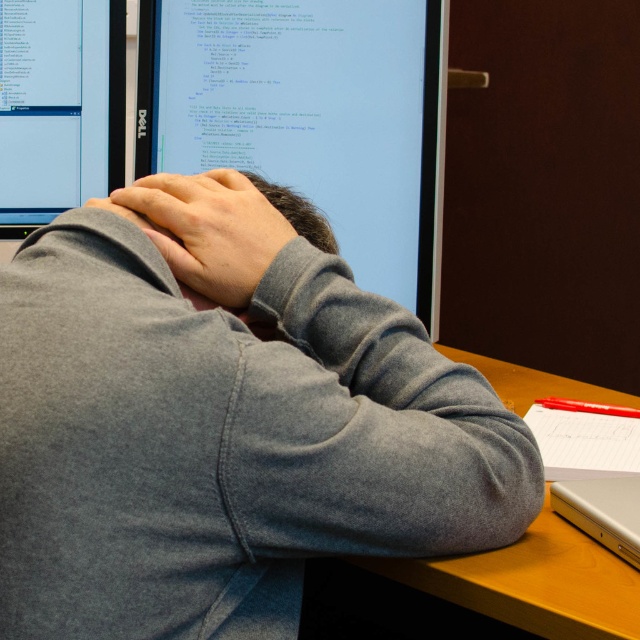
Does matte black monitor at center appear under matte black monitor at upper left?

Yes, matte black monitor at center is below matte black monitor at upper left.

Is point (365, 42) behind point (54, 108)?

No.

At what (x,y) coordinates should I click in order to perform the action: click on matte black monitor at center. Please return your answer as a coordinate pair (x, y). The image size is (640, 640). Looking at the image, I should click on (310, 116).

Consider the image. Can you confirm if gray fleece at center is positioned to the right of silver metallic laptop at lower right?

Incorrect, gray fleece at center is not on the right side of silver metallic laptop at lower right.

Between gray fleece at center and silver metallic laptop at lower right, which one is positioned higher?

Positioned higher is gray fleece at center.

Locate an element on the screen. gray fleece at center is located at coordinates (211, 228).

Locate an element on the screen. The height and width of the screenshot is (640, 640). gray fleece at center is located at coordinates (211, 228).

Who is positioned more to the left, wooden at center or gray fleece at center?

gray fleece at center is more to the left.

Between wooden at center and gray fleece at center, which one is positioned lower?

wooden at center is below.

Between point (497, 589) and point (179, 276), which one is positioned behind?

The point (179, 276) is behind.

Locate an element on the screen. This screenshot has height=640, width=640. wooden at center is located at coordinates (534, 582).